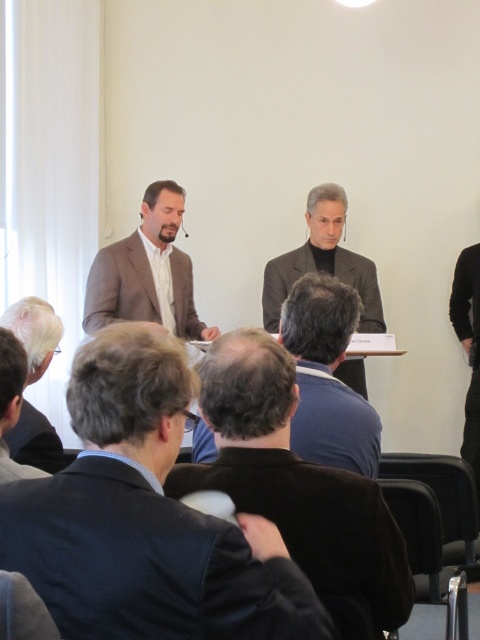
Looking at this image, you are a photographer standing at the front of the room. You want to take a closeup photo of the white hair at lower left without moving the camera. Can you zoom in enough to capture it clearly?

The white hair at lower left is 5.59 feet away from the camera. If your camera has sufficient zoom capabilities, you can likely capture it clearly without moving the camera.